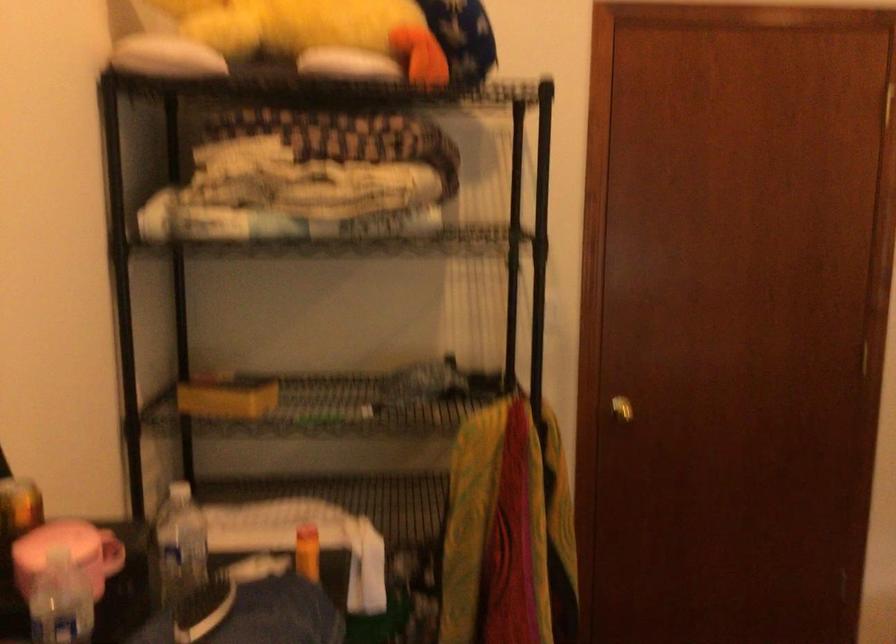
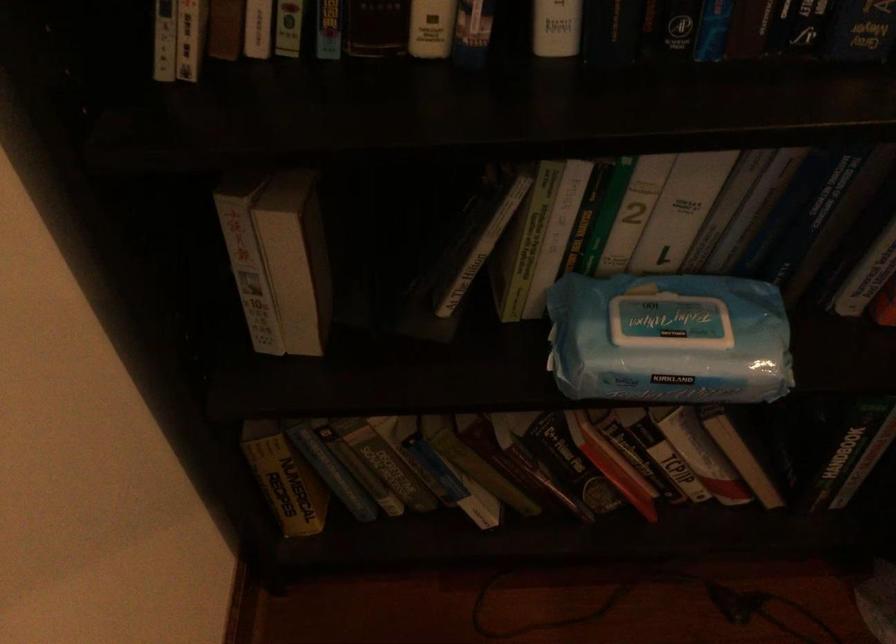
The first image is from the beginning of the video and the second image is from the end. How did the camera likely rotate when shooting the video?

The rotation direction of the camera is left-down.